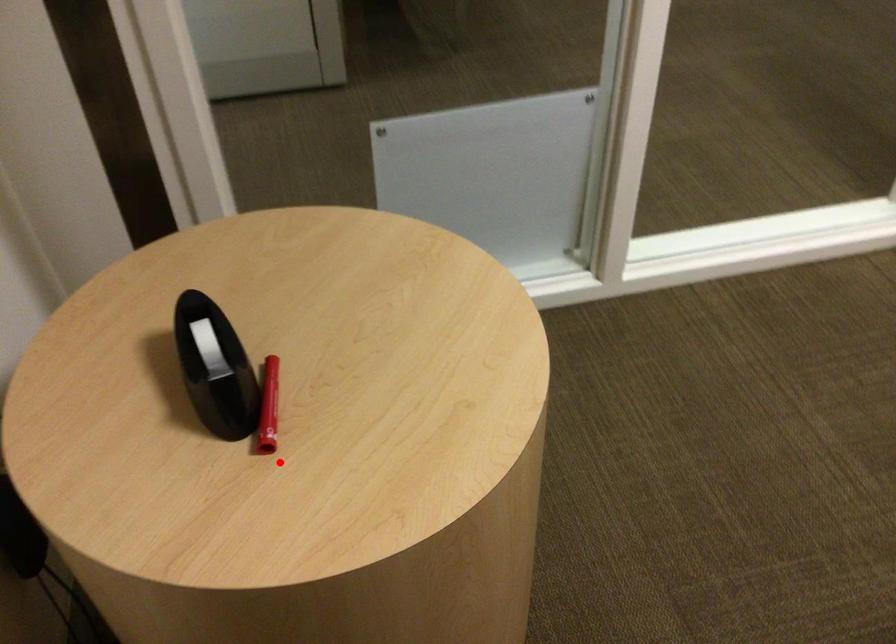
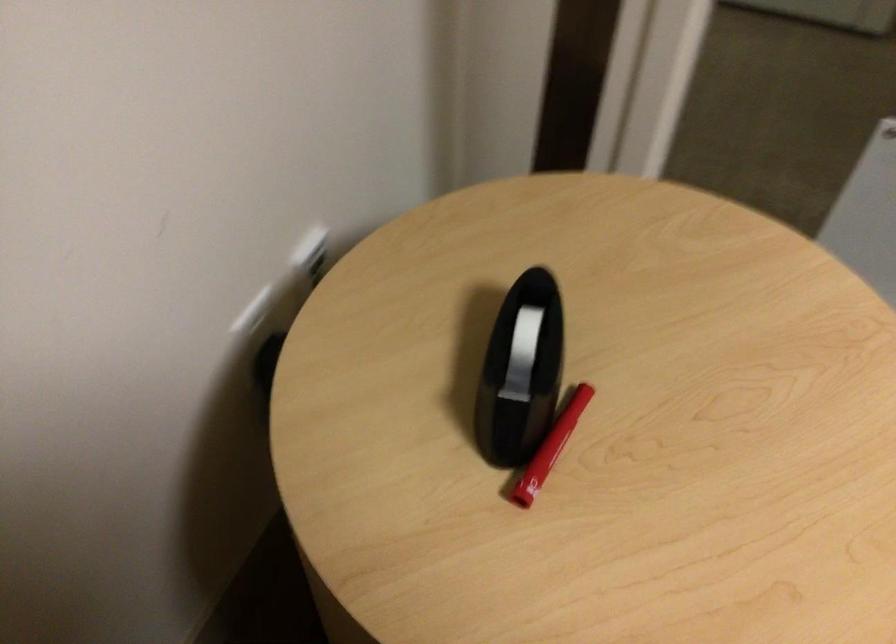
Question: I am providing you with two images of the same scene from different viewpoints. Image1 has a red point marked. In image2, the corresponding 3D location appears at what relative position? Reply with the corresponding letter.

Choices:
 (A) Closer
 (B) Farther

Answer: (A)